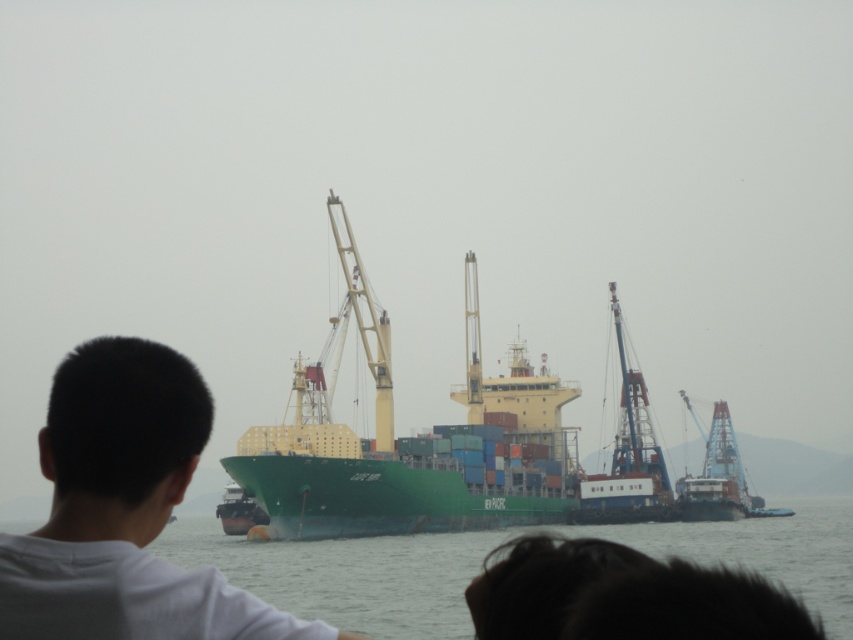
You are a photographer positioned at the scene. You want to capture a photo of the yellow metallic crane at center without including the white matte shirt at center in the frame. Based on their positions, is this possible?

The white matte shirt at center is located below the yellow metallic crane at center, so if you position yourself to capture the crane from above or adjust the angle to exclude the lower area where the shirt is, it should be possible to exclude the white matte shirt at center while focusing on the yellow metallic crane at center.

You are standing on a platform overlooking the maritime scene. You see the green matte water at center and the yellow metallic crane at center. Which object is positioned lower in the scene?

The green matte water at center is positioned below the yellow metallic crane at center, so it is lower in the scene.